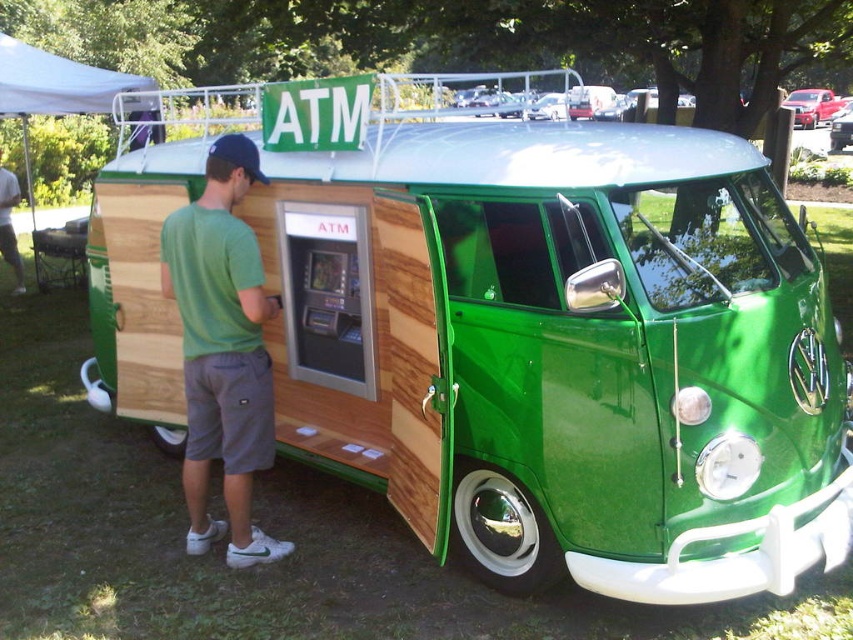
Please look at the image. There is a point marked at coordinates [811,106]. Based on the scene description, can you identify which object this point is located on?

The point at coordinates [811,106] is located on the shiny red car at upper right.

You are standing in front of the vintage green Volkswagen van ATM. There are two points marked on the van. The first point is at coordinates point (253, 410) and the second point is at point (146, 86). Which point is closer to you?

Point (253, 410) is closer to the camera than point (146, 86).

What are the coordinates of the green matte shirt at left?

The green matte shirt at left is located at coordinates point (222,349).